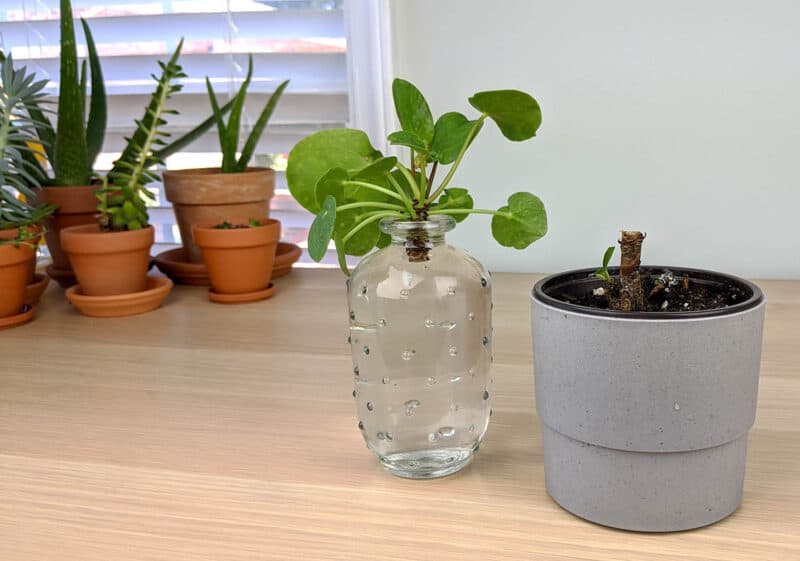
Locate an element on the screen. white wall is located at coordinates (645, 114).